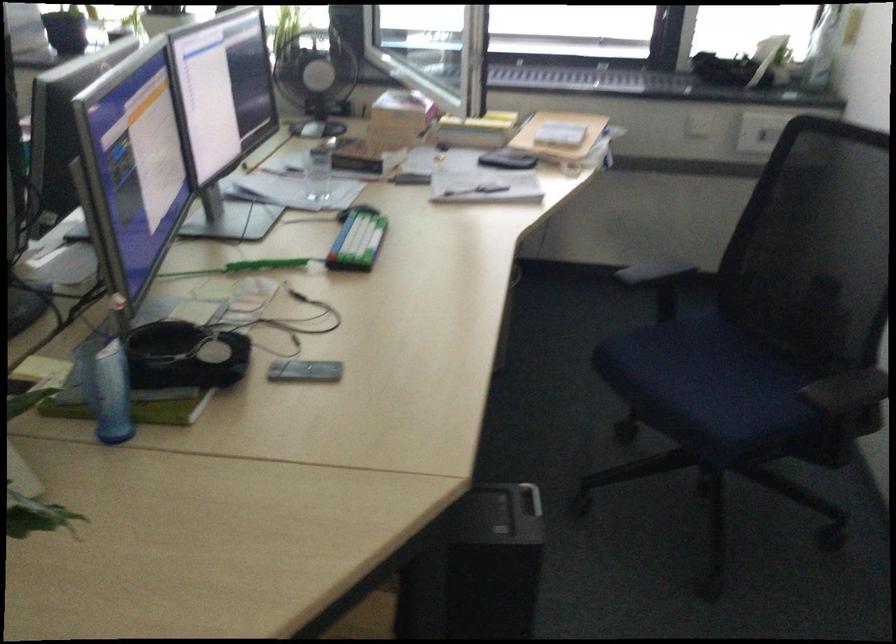
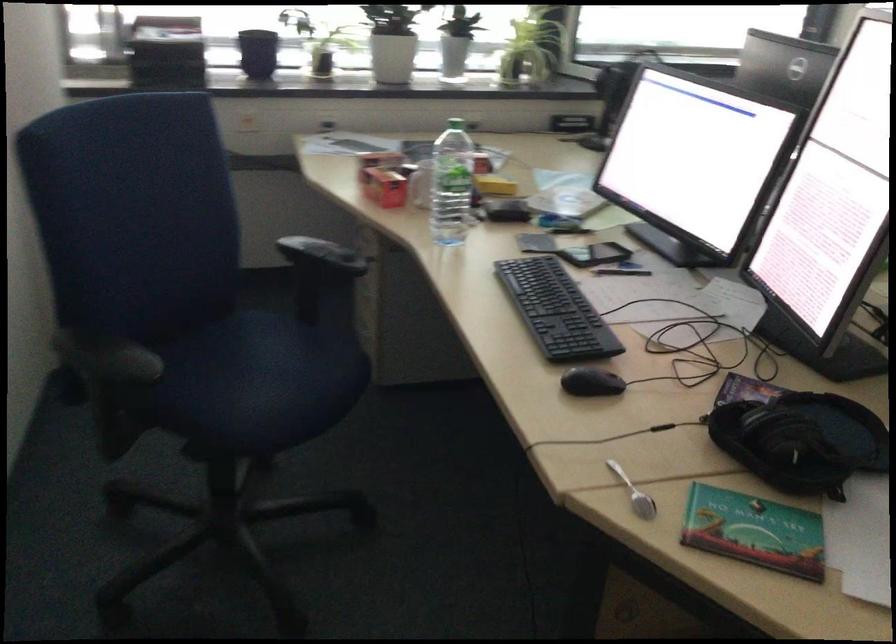
Question: Which direction would the cameraman need to move to produce the second image? Reply with the corresponding letter.

Choices:
 (A) Left
 (B) Right
 (C) Forward
 (D) Backward

Answer: (A)